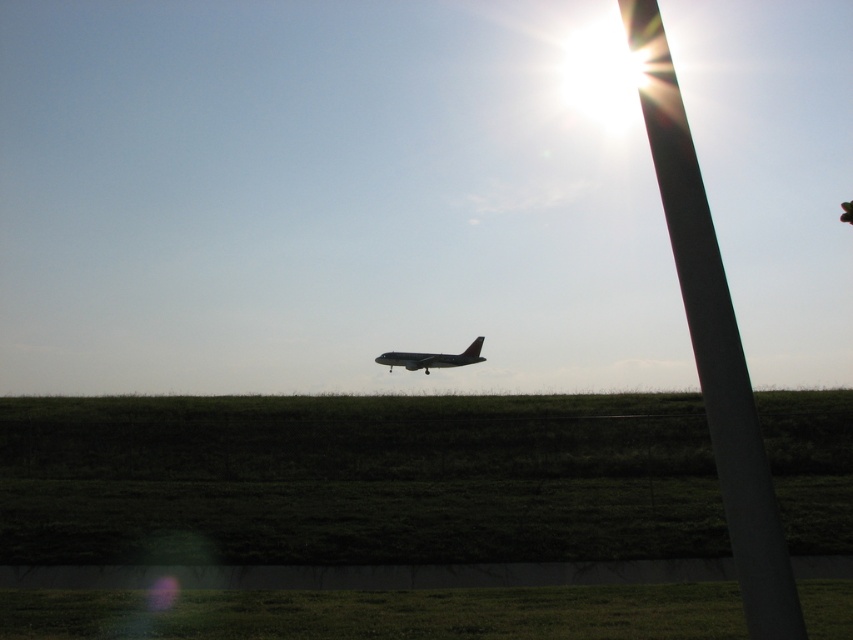
Is point (757, 586) positioned behind point (463, 358)?

No.

Can you confirm if white smooth pole at upper right is bigger than metallic gray airplane at center?

Correct, white smooth pole at upper right is larger in size than metallic gray airplane at center.

The height and width of the screenshot is (640, 853). What are the coordinates of `white smooth pole at upper right` in the screenshot? It's located at (714, 340).